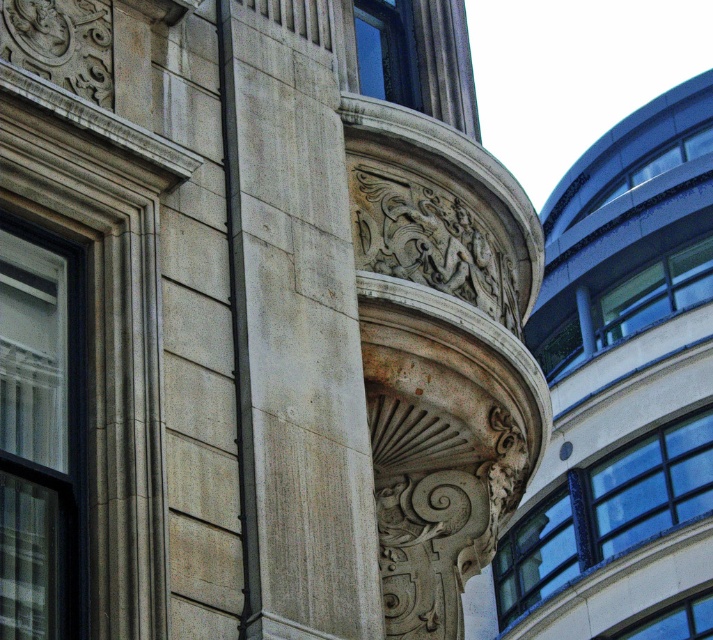
Question: Can you confirm if smooth concrete tower at center is positioned to the right of light gray stone column at center?

Choices:
 (A) no
 (B) yes

Answer: (B)

Question: Is light gray stone column at center above black metal pole at center?

Choices:
 (A) yes
 (B) no

Answer: (A)

Question: Considering the relative positions of light gray stone column at center and black metal pole at center in the image provided, where is light gray stone column at center located with respect to black metal pole at center?

Choices:
 (A) right
 (B) left

Answer: (A)

Question: Based on their relative distances, which object is farther from the black metal pole at center?

Choices:
 (A) light gray stone column at center
 (B) smooth concrete tower at center

Answer: (B)

Question: Which point is farther to the camera?

Choices:
 (A) (692, 522)
 (B) (237, 480)
 (C) (302, 64)

Answer: (A)

Question: Which point is closer to the camera?

Choices:
 (A) light gray stone column at center
 (B) black metal pole at center

Answer: (A)